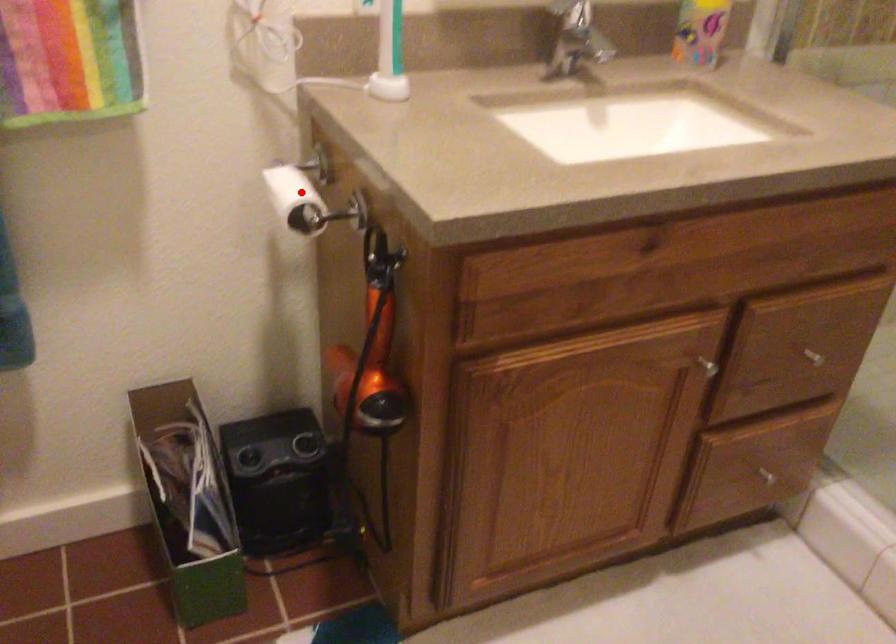
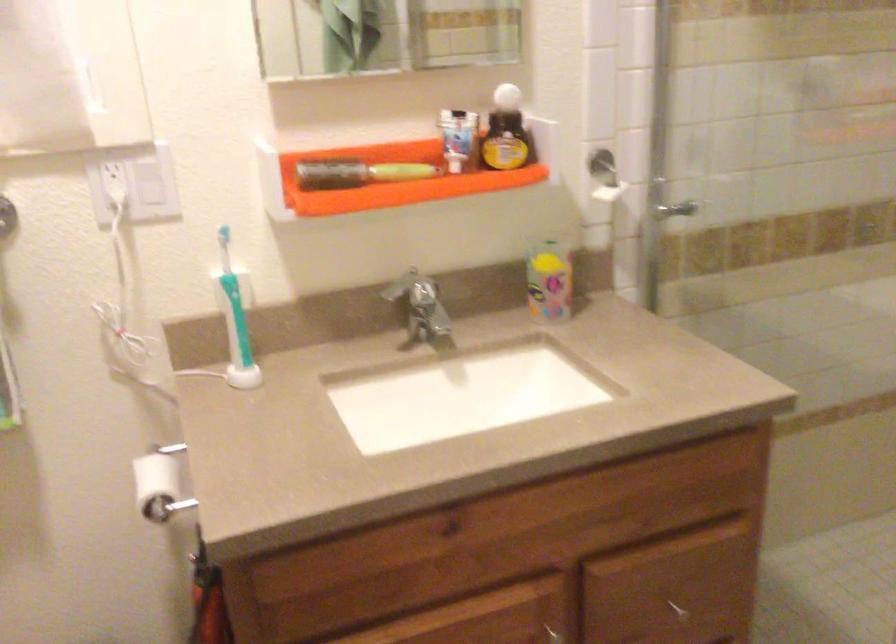
Question: I am providing you with two images of the same scene from different viewpoints. A red point is marked on the first image. Can you still see the location of the red point in image 2?

Choices:
 (A) Yes
 (B) No

Answer: (A)